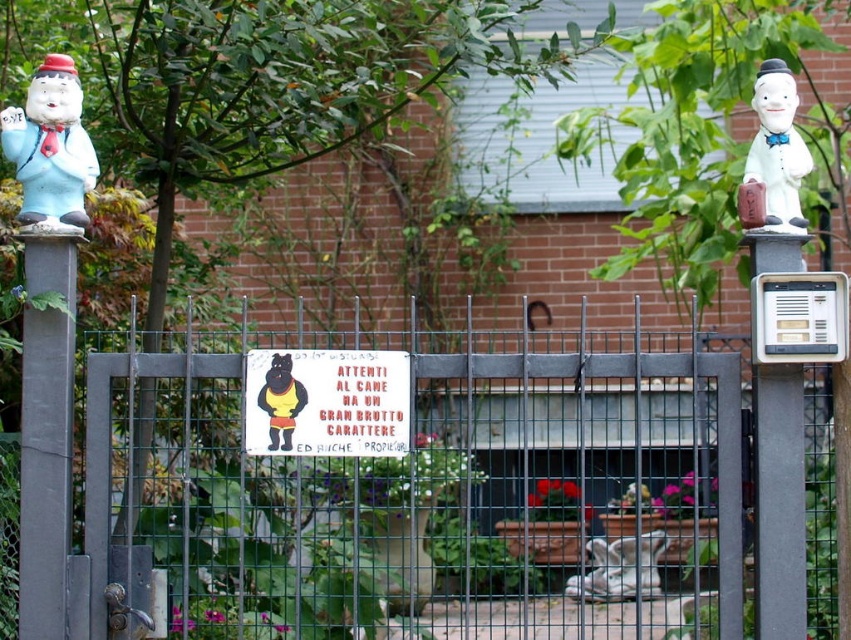
You are a delivery person trying to enter the property. You see the metallic wire mesh gate at center and the white plastic intercom at right. Which object is wider?

The metallic wire mesh gate at center is narrower than the white plastic intercom at right, so the white plastic intercom at right is wider.

In the scene shown: You are a delivery person approaching the metal gate with the dog sign. You need to locate the white plastic intercom at right. Where should you look relative to the gate?

The white plastic intercom at right is located at point 0.497 on the x axis and 0.940 on the y axis relative to the gate.